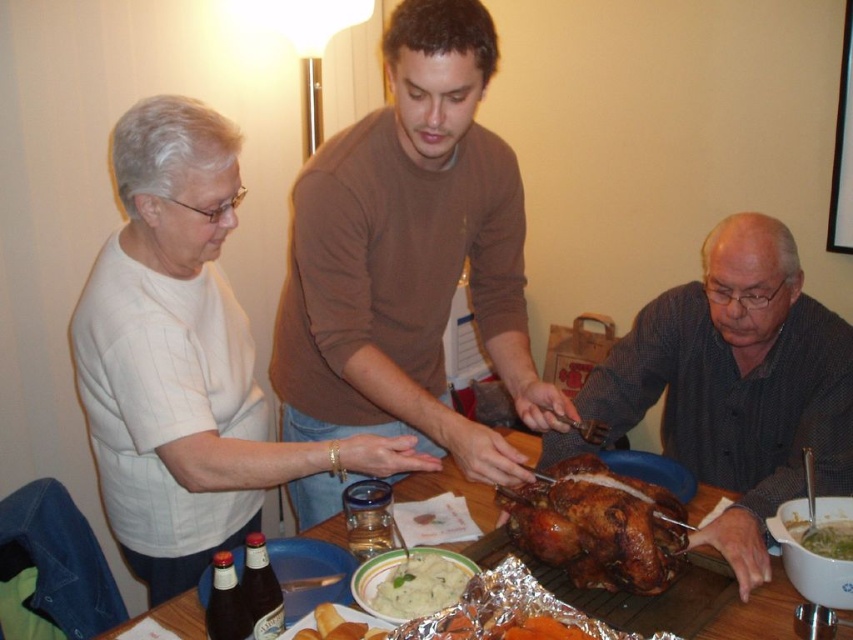
Question: Is dark gray shirt at center to the left of wooden table at center from the viewer's perspective?

Choices:
 (A) no
 (B) yes

Answer: (A)

Question: Estimate the real-world distances between objects in this image. Which object is closer to the wooden table at center?

Choices:
 (A) white creamy soup at center
 (B) dark gray shirt at center

Answer: (B)

Question: Which object appears closest to the camera in this image?

Choices:
 (A) white creamy mashed potatoes at center
 (B) golden brown roasted turkey at center

Answer: (A)

Question: Which object is closer to the camera taking this photo?

Choices:
 (A) white creamy mashed potatoes at center
 (B) dark gray shirt at center

Answer: (A)

Question: Can you confirm if brown sweater at center is bigger than wooden table at center?

Choices:
 (A) no
 (B) yes

Answer: (B)

Question: Does wooden table at center appear under white creamy mashed potatoes at center?

Choices:
 (A) no
 (B) yes

Answer: (A)